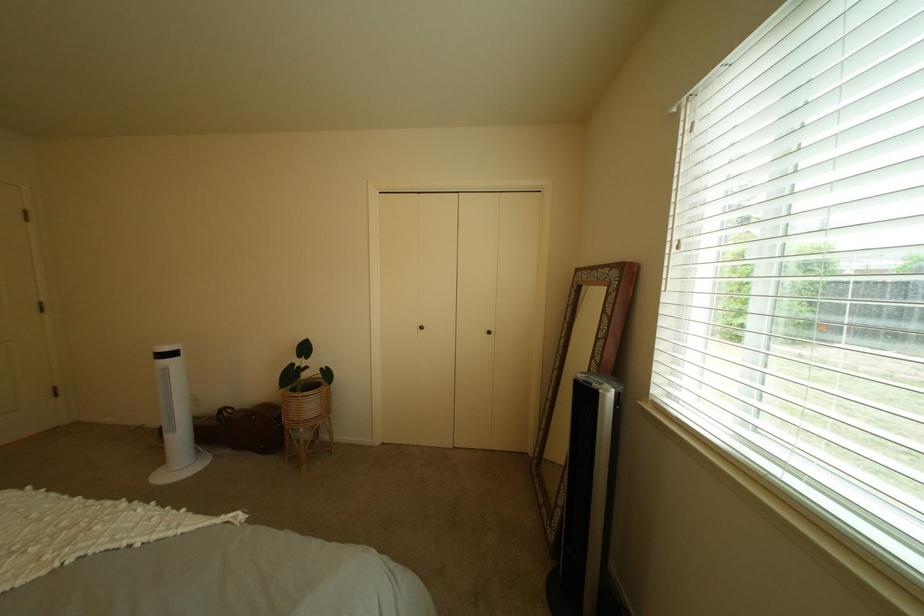
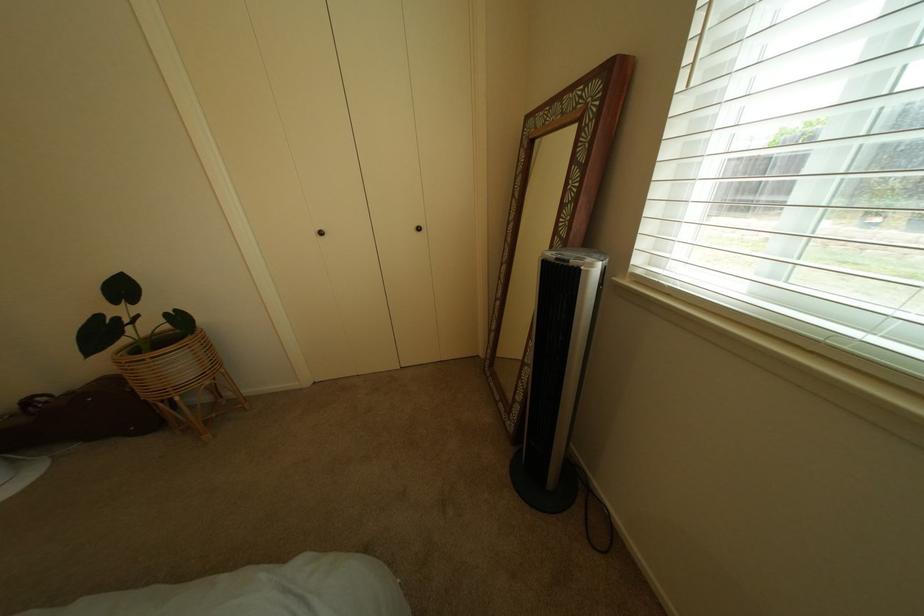
Question: What movement of the cameraman would produce the second image?

Choices:
 (A) Left
 (B) Right
 (C) Forward
 (D) Backward

Answer: (C)